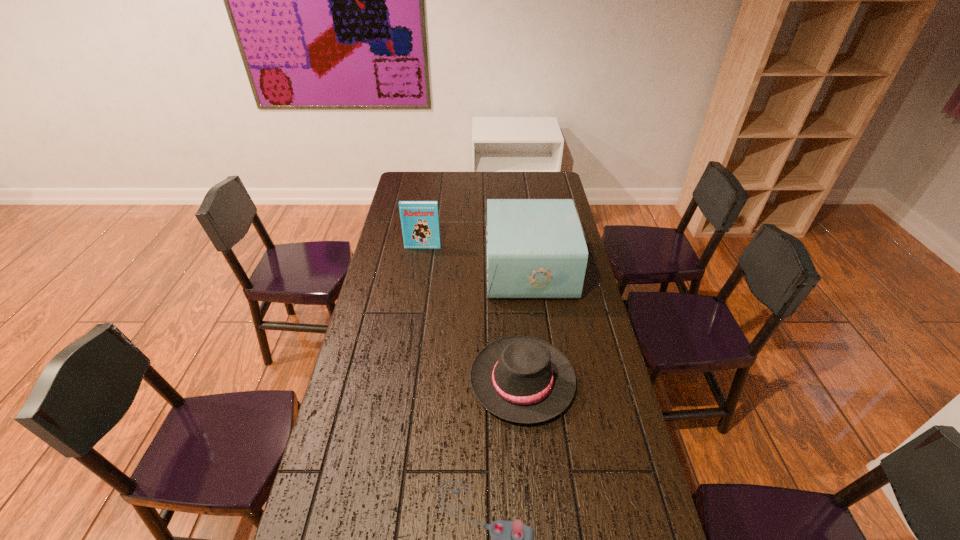
The height and width of the screenshot is (540, 960). I want to click on radio receiver, so click(536, 249).

What are the coordinates of `book` in the screenshot? It's located at (419, 219).

Image resolution: width=960 pixels, height=540 pixels. I want to click on dress hat, so click(x=522, y=379).

The image size is (960, 540). Identify the location of vacant space located 0.120m on the front panel of the radio receiver. (457, 269).

Where is `vacant space located on the front panel of the radio receiver`? The height and width of the screenshot is (540, 960). vacant space located on the front panel of the radio receiver is located at coordinates (454, 269).

The height and width of the screenshot is (540, 960). I want to click on free region located 0.400m on the front panel of the radio receiver, so click(x=389, y=269).

What are the coordinates of `vacant space located 0.050m on the front cover of the leftmost object` in the screenshot? It's located at (421, 256).

Where is `vacant area situated 0.110m on the right of the dress hat`? The width and height of the screenshot is (960, 540). vacant area situated 0.110m on the right of the dress hat is located at coordinates (610, 381).

At what (x,y) coordinates should I click in order to perform the action: click on object located in the left edge section of the desktop. Please return your answer as a coordinate pair (x, y). This screenshot has width=960, height=540. Looking at the image, I should click on (419, 219).

The width and height of the screenshot is (960, 540). I want to click on radio receiver located in the right edge section of the desktop, so tap(536, 249).